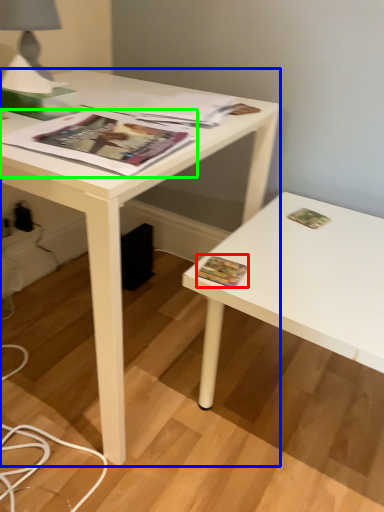
Question: Which object is positioned farthest from paperback book (highlighted by a red box)? Select from desk (highlighted by a blue box) and magazine (highlighted by a green box).

Choices:
 (A) desk
 (B) magazine

Answer: (A)